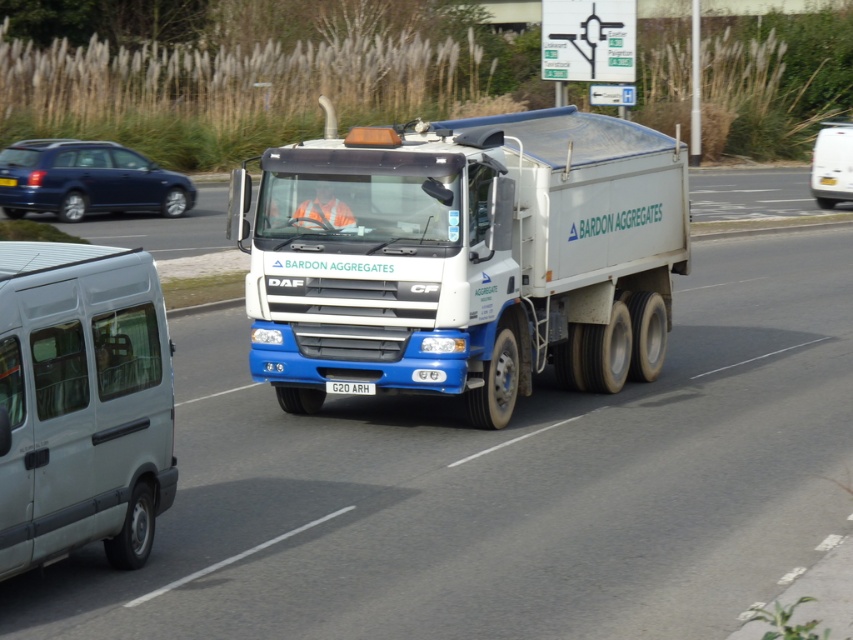
You are a delivery driver who needs to park your vehicle near the white plastic license plate at center. There is a white matte van at lower left blocking the path. Can you safely maneuver around it without hitting the van?

The white matte van at lower left is 3.78 meters away from the white plastic license plate at center. Since the distance between them is sufficient, you can safely maneuver around the van without collision.

You are a pedestrian standing at the center of the road. You see a metallic blue station wagon at left and a white matte van at right. Can you safely cross the road between them without getting hit?

The metallic blue station wagon at left is 56.54 feet from the white matte van at right. Since the distance between them is over 50 feet, you can safely cross the road between them.